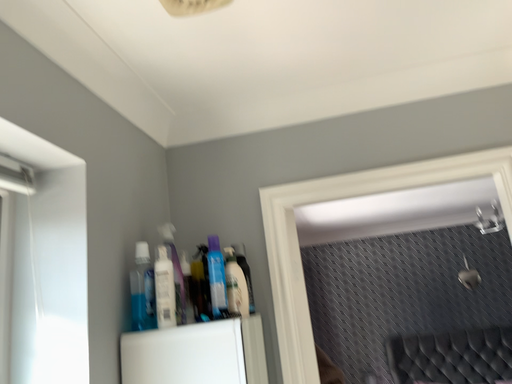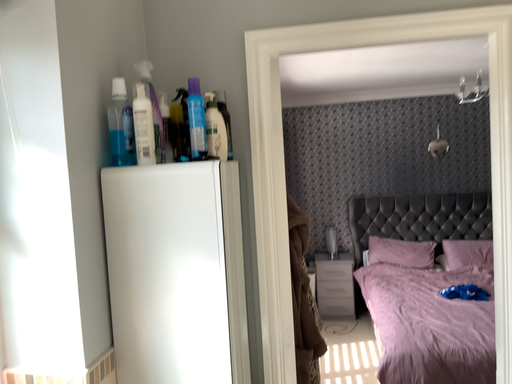
Question: Which way did the camera rotate in the video?

Choices:
 (A) rotated upward
 (B) rotated downward

Answer: (B)